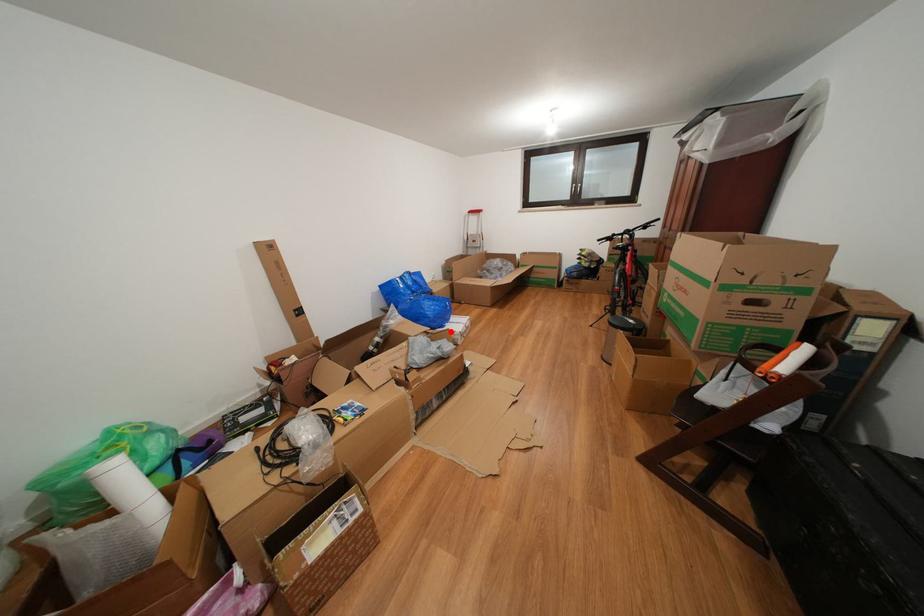
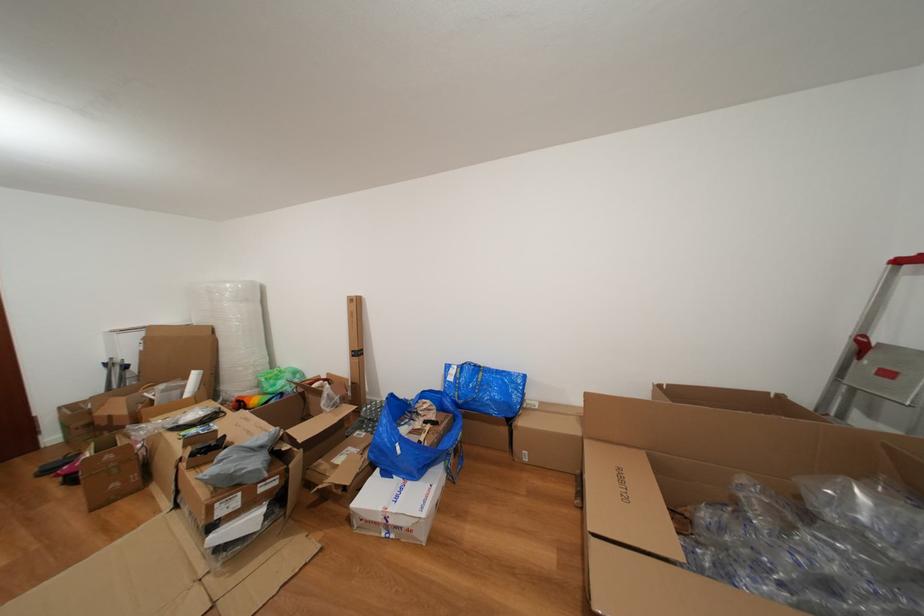
Where in the second image is the point corresponding to the highlighted location from the first image?

(394, 479)